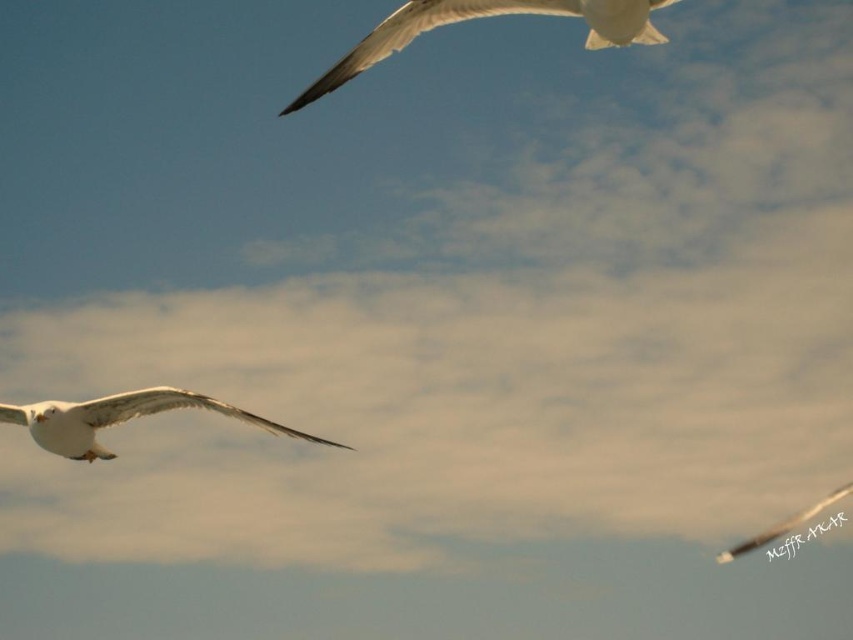
Which is in front, point (48, 420) or point (809, 516)?

Point (809, 516) is more forward.

The image size is (853, 640). Identify the location of white feathered bird at center. (119, 419).

Can you confirm if white feathered bird at upper center is wider than white feathered bird at upper left?

Yes.

Which is in front, point (553, 4) or point (813, 513)?

Point (553, 4) is in front.

At what (x,y) coordinates should I click in order to perform the action: click on white feathered bird at upper center. Please return your answer as a coordinate pair (x, y). This screenshot has height=640, width=853. Looking at the image, I should click on (482, 17).

Is the position of white feathered bird at upper center less distant than that of white feathered bird at center?

That is True.

Which of these two, white feathered bird at upper center or white feathered bird at center, stands shorter?

white feathered bird at center is shorter.

Where is `white feathered bird at upper center`? white feathered bird at upper center is located at coordinates (482, 17).